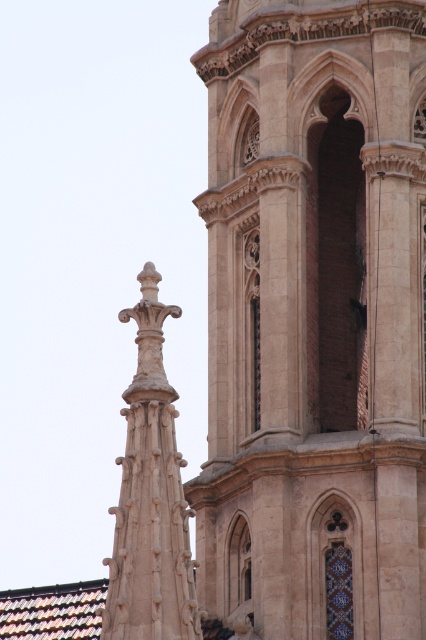
Question: Which point is closer to the camera?

Choices:
 (A) (253, 490)
 (B) (127, 625)

Answer: (B)

Question: Does beige stone tower at center lie in front of carved stone spire at upper left?

Choices:
 (A) yes
 (B) no

Answer: (B)

Question: Observing the image, what is the correct spatial positioning of beige stone tower at center in reference to carved stone spire at upper left?

Choices:
 (A) above
 (B) below

Answer: (A)

Question: Which point is closer to the camera?

Choices:
 (A) (261, 378)
 (B) (178, 492)

Answer: (B)

Question: Does beige stone tower at center have a smaller size compared to carved stone spire at upper left?

Choices:
 (A) no
 (B) yes

Answer: (A)